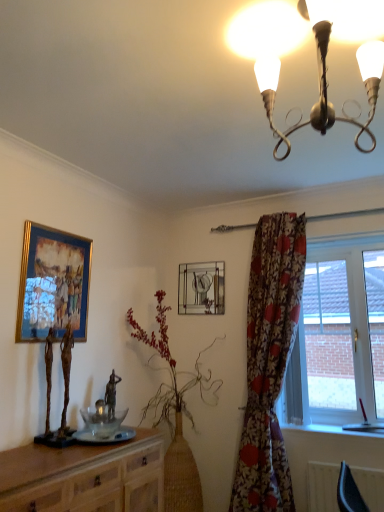
Question: Is gold-framed painting at upper left, which appears as the first picture frame when viewed from the front, facing away from floral fabric curtain at right?

Choices:
 (A) yes
 (B) no

Answer: (B)

Question: Are gold-framed painting at upper left, the second picture frame viewed from the back, and floral fabric curtain at right beside each other?

Choices:
 (A) no
 (B) yes

Answer: (A)

Question: Can you confirm if gold-framed painting at upper left, which appears as the first picture frame when viewed from the front, is smaller than floral fabric curtain at right?

Choices:
 (A) no
 (B) yes

Answer: (B)

Question: Does gold-framed painting at upper left, the second picture frame viewed from the back, appear on the left side of floral fabric curtain at right?

Choices:
 (A) yes
 (B) no

Answer: (A)

Question: Is gold-framed painting at upper left, which appears as the first picture frame when viewed from the front, not near floral fabric curtain at right?

Choices:
 (A) no
 (B) yes

Answer: (B)

Question: Looking at their shapes, would you say green leafy plant at center is wider or thinner than metallic glass clock at center, which is counted as the 2th picture frame, starting from the front?

Choices:
 (A) thin
 (B) wide

Answer: (B)

Question: From the image's perspective, is green leafy plant at center positioned above or below metallic glass clock at center, positioned as the first picture frame in right-to-left order?

Choices:
 (A) above
 (B) below

Answer: (B)

Question: Based on their positions, is green leafy plant at center located to the left or right of metallic glass clock at center, which is the 1th picture frame from back to front?

Choices:
 (A) right
 (B) left

Answer: (B)

Question: From a real-world perspective, is green leafy plant at center positioned above or below metallic glass clock at center, which is the second picture frame from left to right?

Choices:
 (A) above
 (B) below

Answer: (B)

Question: Is wooden cabinet at lower left spatially inside metallic chandelier at upper center, or outside of it?

Choices:
 (A) inside
 (B) outside

Answer: (B)

Question: Considering the positions of wooden cabinet at lower left and metallic chandelier at upper center in the image, is wooden cabinet at lower left bigger or smaller than metallic chandelier at upper center?

Choices:
 (A) small
 (B) big

Answer: (B)

Question: Considering the positions of wooden cabinet at lower left and metallic chandelier at upper center in the image, is wooden cabinet at lower left taller or shorter than metallic chandelier at upper center?

Choices:
 (A) tall
 (B) short

Answer: (A)

Question: From a real-world perspective, is wooden cabinet at lower left positioned above or below metallic chandelier at upper center?

Choices:
 (A) below
 (B) above

Answer: (A)

Question: Is wooden cabinet at lower left wider or thinner than floral fabric curtain at right?

Choices:
 (A) thin
 (B) wide

Answer: (B)

Question: From a real-world perspective, is wooden cabinet at lower left physically located above or below floral fabric curtain at right?

Choices:
 (A) below
 (B) above

Answer: (A)